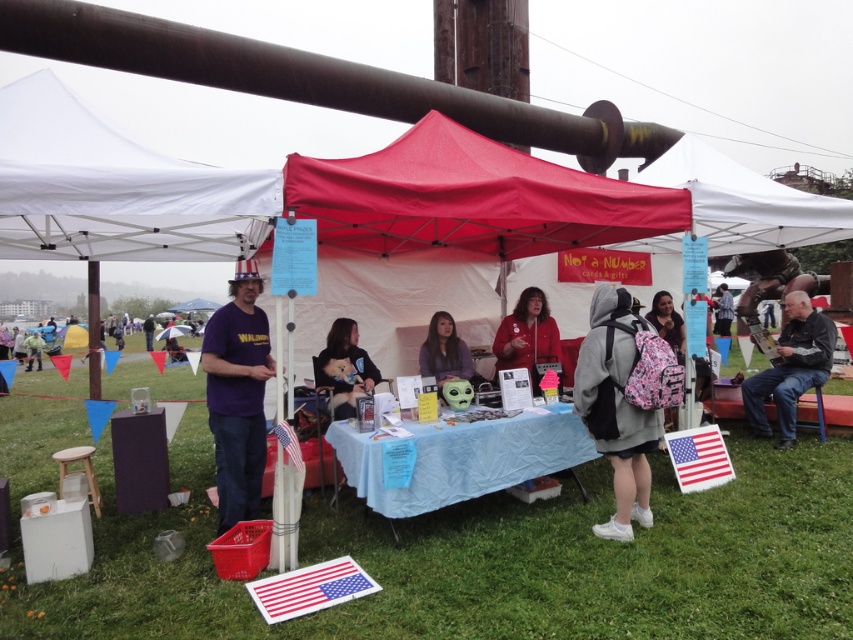
Who is lower down, red fabric canopy at center or leather jacket at lower right?

leather jacket at lower right is below.

This screenshot has width=853, height=640. In order to click on red fabric canopy at center in this screenshot , I will do `click(469, 198)`.

Is plaid shirt at center closer to the viewer compared to matte purple shirt at center?

Yes.

Is plaid shirt at center to the left of matte purple shirt at center from the viewer's perspective?

Incorrect, plaid shirt at center is not on the left side of matte purple shirt at center.

Between point (717, 320) and point (38, 348), which one is positioned behind?

Positioned behind is point (38, 348).

Locate an element on the screen. The image size is (853, 640). plaid shirt at center is located at coordinates (723, 310).

Who is shorter, white fabric canopy at upper left or soft gray sweater at center?

Standing shorter between the two is white fabric canopy at upper left.

Does point (85, 189) come closer to viewer compared to point (321, 362)?

Yes, point (85, 189) is closer to viewer.

What do you see at coordinates (115, 189) in the screenshot?
I see `white fabric canopy at upper left` at bounding box center [115, 189].

The image size is (853, 640). Find the location of `white fabric canopy at upper left`. white fabric canopy at upper left is located at coordinates tap(115, 189).